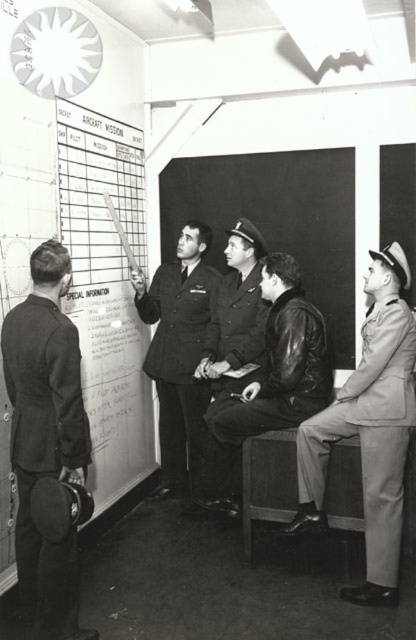
You are a military planner standing at the center of the room. You need to update the white paperboard at left. Which direction should you move to reach it?

The white paperboard at left is located at point (106, 289), so you should move to the left and slightly forward to reach it.

You are a military officer standing in the briefing room. You need to locate the white paperboard at left and the dark suit at left. Which one is positioned to the right side of the other?

The white paperboard at left is to the right of dark suit at left.

You are a military officer in the room. You need to retrieve a document from the white paperboard at left while standing near the dark blue leather jacket at center. Can you reach the paperboard without moving from your current position?

The white paperboard at left is positioned on the left side of dark blue leather jacket at center, so you can reach the white paperboard at left without moving from your current position.